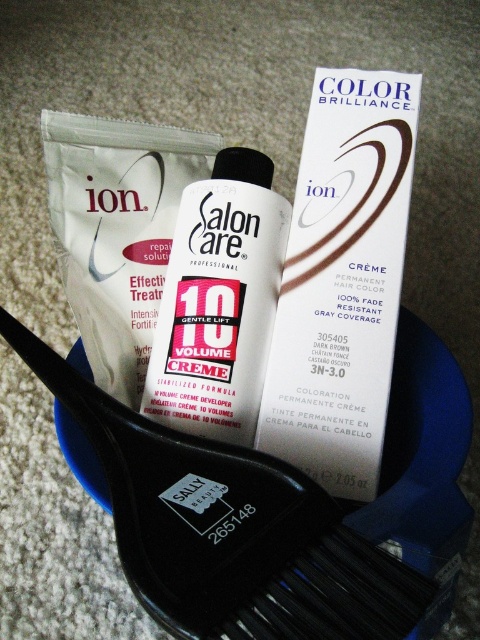
Question: Which point is closer to the camera?

Choices:
 (A) black plastic brush at center
 (B) dark brown cream at upper right
 (C) white glossy bottle at center

Answer: (A)

Question: From the image, what is the correct spatial relationship of black plastic brush at center in relation to dark brown cream at upper right?

Choices:
 (A) above
 (B) below

Answer: (B)

Question: Can you confirm if dark brown cream at upper right is positioned below white glossy bottle at center?

Choices:
 (A) yes
 (B) no

Answer: (B)

Question: Does black plastic brush at center have a smaller size compared to white glossy bottle at center?

Choices:
 (A) yes
 (B) no

Answer: (B)

Question: Which of these objects is positioned closest to the black plastic brush at center?

Choices:
 (A) dark brown cream at upper right
 (B) white glossy bottle at center

Answer: (B)

Question: Which point is closer to the camera taking this photo?

Choices:
 (A) (304, 522)
 (B) (162, 353)
 (C) (331, 168)

Answer: (A)